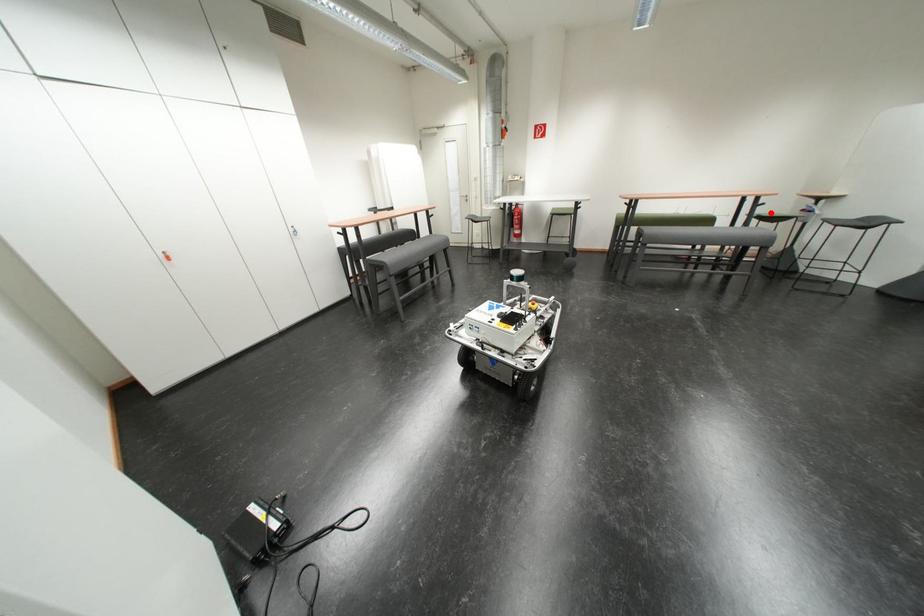
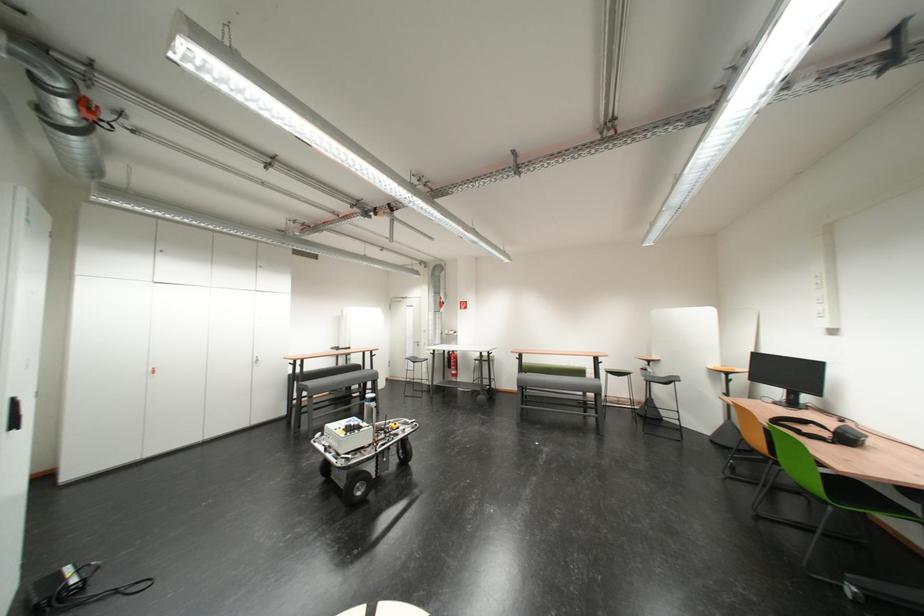
Question: A red point is marked in image1. In image2, is the corresponding 3D point closer to the camera or farther? Reply with the corresponding letter.

Choices:
 (A) The corresponding 3D point is closer.
 (B) The corresponding 3D point is farther.

Answer: (B)